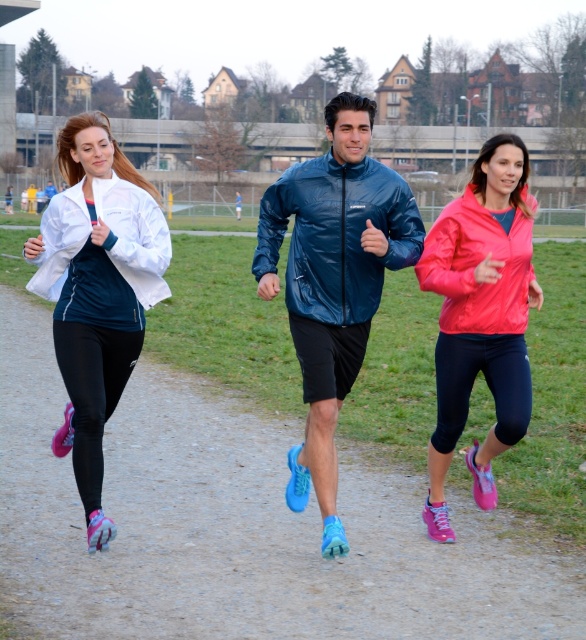
You are a photographer trying to capture a group photo of the runners. Since you want to ensure all subjects are visible, you need to adjust your camera angle so that the white matte jacket at left and the matte pink jacket at right are both fully in frame. Given their sizes, which jacket requires you to focus more on including it in the shot?

The matte pink jacket at right requires more focus to include in the shot because it occupies more space than the white matte jacket at left.

In the scene shown: You are a photographer positioned to the side of the runners. You want to capture a photo that includes both the matte pink jacket at center and the matte pink jacket at right. Which of these two jackets will appear wider in the photo?

The matte pink jacket at right will appear wider in the photo because it has a greater width compared to the matte pink jacket at center.